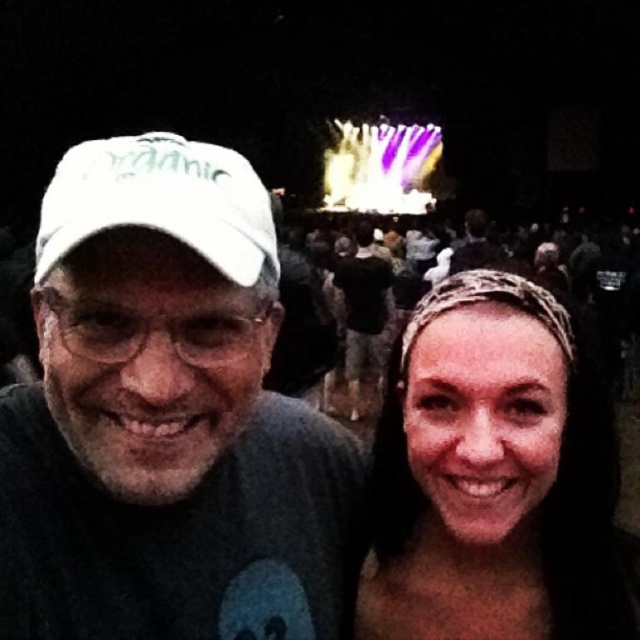
Question: Based on their relative distances, which object is farther from the white fabric baseball cap at left?

Choices:
 (A) smooth skin headband at center
 (B) white matte cap at upper left

Answer: (A)

Question: Which of the following is the closest to the observer?

Choices:
 (A) white matte cap at upper left
 (B) white fabric baseball cap at left

Answer: (A)

Question: Can you confirm if white matte cap at upper left is bigger than smooth skin headband at center?

Choices:
 (A) no
 (B) yes

Answer: (A)

Question: Which object is closer to the camera taking this photo?

Choices:
 (A) white matte cap at upper left
 (B) white fabric baseball cap at left
 (C) smooth skin headband at center

Answer: (A)

Question: Is smooth skin headband at center closer to camera compared to white fabric baseball cap at left?

Choices:
 (A) yes
 (B) no

Answer: (B)

Question: Is smooth skin headband at center behind white fabric baseball cap at left?

Choices:
 (A) no
 (B) yes

Answer: (B)